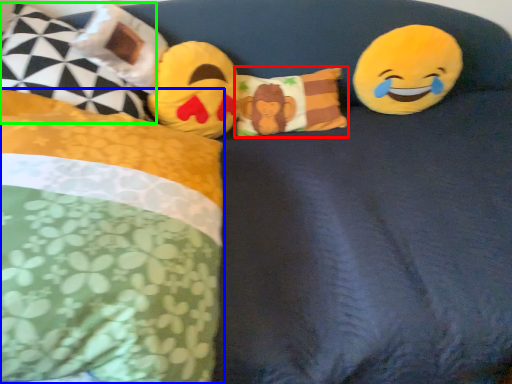
Question: Considering the real-world distances, which object is closest to pillow (highlighted by a red box)? pillow (highlighted by a blue box) or pillow (highlighted by a green box).

Choices:
 (A) pillow
 (B) pillow

Answer: (B)